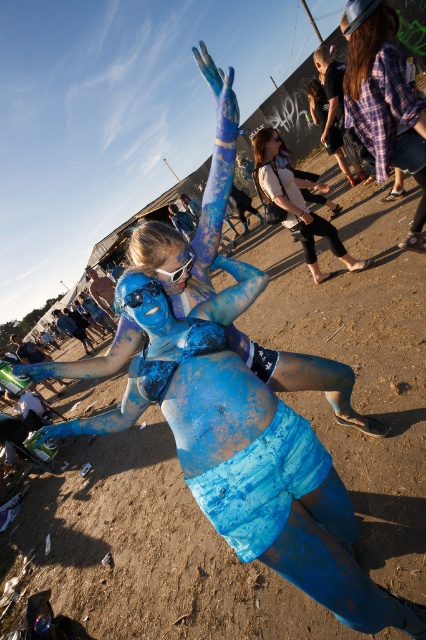
Does plaid fabric shirt at upper right appear under matte blue face at center?

No, plaid fabric shirt at upper right is not below matte blue face at center.

Measure the distance between point (x=425, y=202) and camera.

Point (x=425, y=202) is 3.95 meters away from camera.

Is point (379, 152) behind point (175, 275)?

Yes, point (379, 152) is behind point (175, 275).

Identify the location of plaid fabric shirt at upper right. The width and height of the screenshot is (426, 640). (385, 100).

From the picture: Between white textured shirt at center and matte blue camera at center, which one has less height?

Standing shorter between the two is matte blue camera at center.

Which is below, white textured shirt at center or matte blue camera at center?

matte blue camera at center

Between point (261, 195) and point (155, 296), which one is positioned behind?

Positioned behind is point (261, 195).

You are a GUI agent. You are given a task and a screenshot of the screen. Output one action in this format:
    pyautogui.click(x=<x>, y=<y>)
    Task: Click on the white textured shirt at center
    The image size is (426, 640).
    Given the screenshot: What is the action you would take?
    pyautogui.click(x=299, y=209)

Is the position of white textured shirt at center more distant than that of matte blue face at center?

Yes, it is.

Is point (259, 184) positioned after point (178, 280)?

Yes, it is.

Image resolution: width=426 pixels, height=640 pixels. Identify the location of white textured shirt at center. (299, 209).